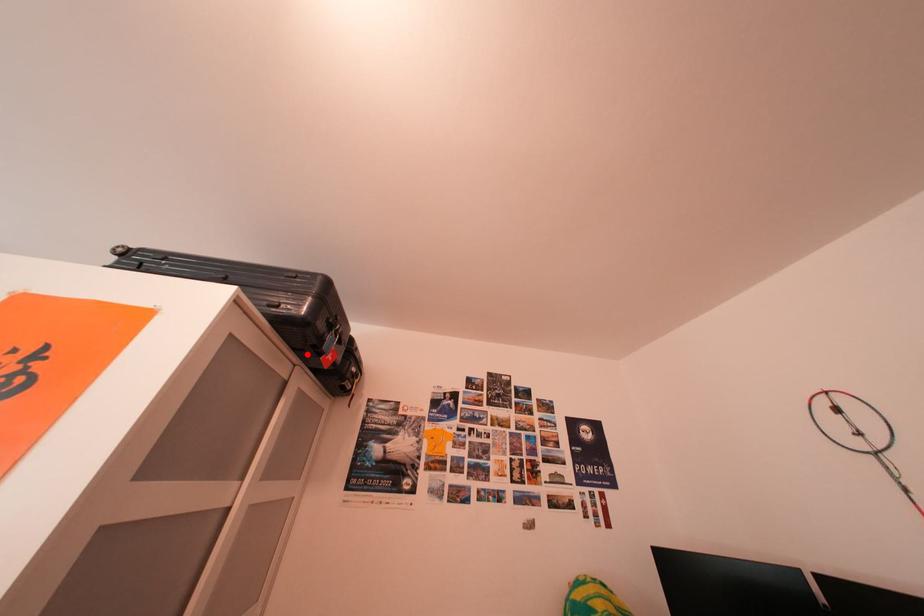
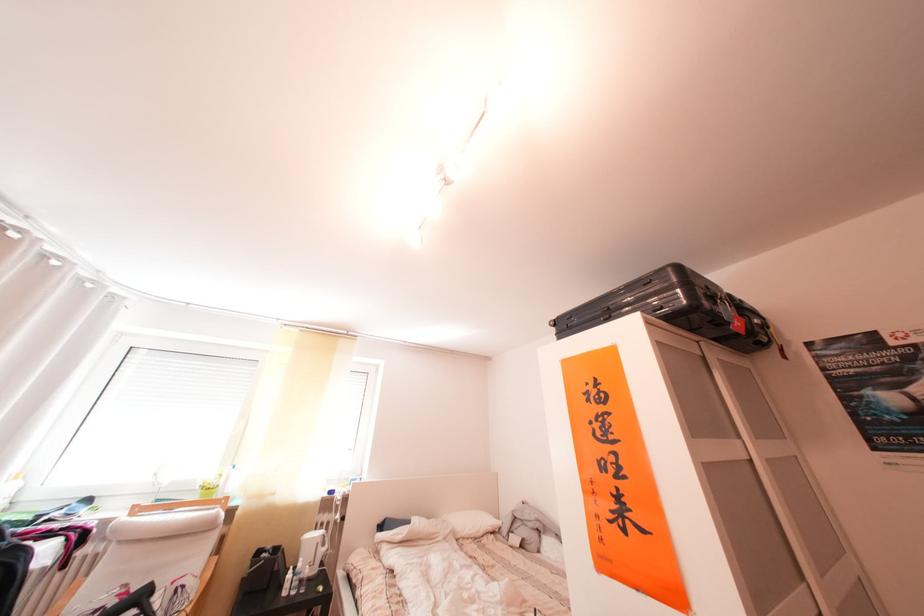
Locate, in the second image, the point that corresponds to the highlighted location in the first image.

(703, 336)